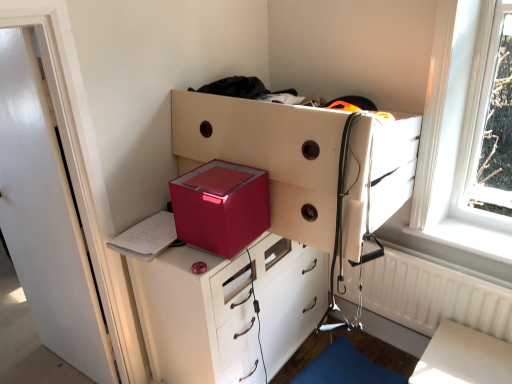
Measure the distance between blue fabric step stool at lower right and camera.

1.98 meters.

Identify the location of metallic red chest of drawers at center, the 2th chest of drawers in the top-to-bottom sequence. The image size is (512, 384). (197, 317).

Where is `metallic white chest of drawers at center, which is the first chest of drawers in top-to-bottom order`? Image resolution: width=512 pixels, height=384 pixels. metallic white chest of drawers at center, which is the first chest of drawers in top-to-bottom order is located at coordinates (269, 155).

Identify the location of white textured radiator at right. (434, 296).

The height and width of the screenshot is (384, 512). What do you see at coordinates (45, 218) in the screenshot? I see `white glossy door at left` at bounding box center [45, 218].

Image resolution: width=512 pixels, height=384 pixels. Identify the location of white glossy table at lower right. (463, 357).

Is white glossy table at lower right not close to white glossy door at left?

Indeed, white glossy table at lower right is not near white glossy door at left.

Considering the points (480, 332) and (69, 331), which point is behind, point (480, 332) or point (69, 331)?

The point (69, 331) is farther.

Between white glossy table at lower right and white glossy door at left, which one has larger size?

With larger size is white glossy door at left.

Which of these two, white glossy table at lower right or white glossy door at left, stands taller?

With more height is white glossy door at left.

Looking at their sizes, would you say metallic red chest of drawers at center, the first chest of drawers when ordered from bottom to top, is wider or thinner than white glossy door at left?

metallic red chest of drawers at center, the first chest of drawers when ordered from bottom to top, is wider than white glossy door at left.

Does metallic red chest of drawers at center, the first chest of drawers when ordered from bottom to top, have a greater height compared to white glossy door at left?

In fact, metallic red chest of drawers at center, the first chest of drawers when ordered from bottom to top, may be shorter than white glossy door at left.

Does point (302, 327) lie in front of point (31, 120)?

No.

Does metallic red chest of drawers at center, the first chest of drawers when ordered from bottom to top, appear on the left side of white glossy door at left?

No, metallic red chest of drawers at center, the first chest of drawers when ordered from bottom to top, is not to the left of white glossy door at left.

Which of these two, white textured radiator at right or white glossy door at left, is thinner?

Thinner between the two is white textured radiator at right.

Is white textured radiator at right outside of white glossy door at left?

Yes.

Between white textured radiator at right and white glossy door at left, which one is positioned in front?

white glossy door at left is more forward.

Is white glossy table at lower right positioned in front of metallic white chest of drawers at center, which is the first chest of drawers in top-to-bottom order?

No, white glossy table at lower right is further to the viewer.

Considering the sizes of white glossy table at lower right and metallic white chest of drawers at center, which appears as the second chest of drawers when ordered from the bottom, in the image, is white glossy table at lower right taller or shorter than metallic white chest of drawers at center, which appears as the second chest of drawers when ordered from the bottom,?

Considering their sizes, white glossy table at lower right has more height than metallic white chest of drawers at center, which appears as the second chest of drawers when ordered from the bottom.

Is white glossy table at lower right to the left of metallic white chest of drawers at center, which appears as the second chest of drawers when ordered from the bottom, from the viewer's perspective?

Incorrect, white glossy table at lower right is not on the left side of metallic white chest of drawers at center, which appears as the second chest of drawers when ordered from the bottom.

Would you say white glossy table at lower right is outside metallic white chest of drawers at center, which appears as the second chest of drawers when ordered from the bottom?

That's correct, white glossy table at lower right is outside of metallic white chest of drawers at center, which appears as the second chest of drawers when ordered from the bottom.

From the image's perspective, between white textured radiator at right and metallic red chest of drawers at center, the first chest of drawers when ordered from bottom to top, who is located below?

white textured radiator at right.

How much distance is there between white textured radiator at right and metallic red chest of drawers at center, the 2th chest of drawers in the top-to-bottom sequence?

white textured radiator at right is 24.00 inches from metallic red chest of drawers at center, the 2th chest of drawers in the top-to-bottom sequence.

Between point (389, 254) and point (301, 320), which one is positioned in front?

Positioned in front is point (389, 254).

Is metallic white chest of drawers at center, which appears as the second chest of drawers when ordered from the bottom, wider than white glossy table at lower right?

Indeed, metallic white chest of drawers at center, which appears as the second chest of drawers when ordered from the bottom, has a greater width compared to white glossy table at lower right.

How different are the orientations of metallic white chest of drawers at center, which appears as the second chest of drawers when ordered from the bottom, and white glossy table at lower right in degrees?

There is a 0.41-degree angle between the facing directions of metallic white chest of drawers at center, which appears as the second chest of drawers when ordered from the bottom, and white glossy table at lower right.

Is metallic white chest of drawers at center, which is the first chest of drawers in top-to-bottom order, taller than white glossy table at lower right?

No.

Does white glossy door at left have a larger size compared to metallic white chest of drawers at center, which is the first chest of drawers in top-to-bottom order?

Actually, white glossy door at left might be smaller than metallic white chest of drawers at center, which is the first chest of drawers in top-to-bottom order.

From a real-world perspective, between white glossy door at left and metallic white chest of drawers at center, which appears as the second chest of drawers when ordered from the bottom, who is vertically lower?

white glossy door at left, from a real-world perspective.

Which object is positioned more to the left, white glossy door at left or metallic white chest of drawers at center, which is the first chest of drawers in top-to-bottom order?

Positioned to the left is white glossy door at left.

The width and height of the screenshot is (512, 384). Identify the location of chest of drawers above the white glossy door at left (from the image's perspective). tap(269, 155).

You are a GUI agent. You are given a task and a screenshot of the screen. Output one action in this format:
    pyautogui.click(x=<x>, y=<y>)
    Task: Click on the door in front of the white glossy table at lower right
    The image size is (512, 384).
    Given the screenshot: What is the action you would take?
    pyautogui.click(x=45, y=218)

Where is `door located above the metallic red chest of drawers at center, the 2th chest of drawers in the top-to-bottom sequence (from the image's perspective)`? Image resolution: width=512 pixels, height=384 pixels. door located above the metallic red chest of drawers at center, the 2th chest of drawers in the top-to-bottom sequence (from the image's perspective) is located at coordinates (45, 218).

When comparing their distances from white textured radiator at right, does metallic red chest of drawers at center, the 2th chest of drawers in the top-to-bottom sequence, or white glossy door at left seem closer?

metallic red chest of drawers at center, the 2th chest of drawers in the top-to-bottom sequence, is closer to white textured radiator at right.

In the scene shown: Estimate the real-world distances between objects in this image. Which object is further from blue fabric step stool at lower right, metallic red chest of drawers at center, the 2th chest of drawers in the top-to-bottom sequence, or white glossy door at left?

white glossy door at left is further to blue fabric step stool at lower right.

Estimate the real-world distances between objects in this image. Which object is further from white glossy door at left, white textured radiator at right or metallic red chest of drawers at center, the first chest of drawers when ordered from bottom to top?

white textured radiator at right lies further to white glossy door at left than the other object.

Looking at the image, which one is located further to blue fabric step stool at lower right, metallic white chest of drawers at center, which is the first chest of drawers in top-to-bottom order, or white glossy table at lower right?

metallic white chest of drawers at center, which is the first chest of drawers in top-to-bottom order, lies further to blue fabric step stool at lower right than the other object.

Based on their spatial positions, is metallic white chest of drawers at center, which is the first chest of drawers in top-to-bottom order, or metallic red chest of drawers at center, the 2th chest of drawers in the top-to-bottom sequence, closer to blue fabric step stool at lower right?

Among the two, metallic red chest of drawers at center, the 2th chest of drawers in the top-to-bottom sequence, is located nearer to blue fabric step stool at lower right.

From the image, which object appears to be nearer to metallic white chest of drawers at center, which is the first chest of drawers in top-to-bottom order, blue fabric step stool at lower right or white glossy door at left?

white glossy door at left lies closer to metallic white chest of drawers at center, which is the first chest of drawers in top-to-bottom order, than the other object.

Looking at the image, which one is located further to blue fabric step stool at lower right, white glossy table at lower right or white textured radiator at right?

The object further to blue fabric step stool at lower right is white glossy table at lower right.

Based on the photo, looking at the image, which one is located further to metallic red chest of drawers at center, the first chest of drawers when ordered from bottom to top, metallic white chest of drawers at center, which appears as the second chest of drawers when ordered from the bottom, or white glossy door at left?

white glossy door at left is further to metallic red chest of drawers at center, the first chest of drawers when ordered from bottom to top.

At what (x,y) coordinates should I click in order to perform the action: click on storage box between white glossy door at left and white textured radiator at right in the horizontal direction. Please return your answer as a coordinate pair (x, y). This screenshot has width=512, height=384. Looking at the image, I should click on (221, 208).

Where is `radiator between metallic white chest of drawers at center, which appears as the second chest of drawers when ordered from the bottom, and white glossy table at lower right vertically`? This screenshot has width=512, height=384. radiator between metallic white chest of drawers at center, which appears as the second chest of drawers when ordered from the bottom, and white glossy table at lower right vertically is located at coordinates (434, 296).

You are a GUI agent. You are given a task and a screenshot of the screen. Output one action in this format:
    pyautogui.click(x=<x>, y=<y>)
    Task: Click on the storage box between white glossy door at left and white glossy table at lower right in the horizontal direction
    The height and width of the screenshot is (384, 512).
    Given the screenshot: What is the action you would take?
    pyautogui.click(x=221, y=208)

I want to click on step stool situated between white glossy door at left and white textured radiator at right from left to right, so click(x=346, y=368).